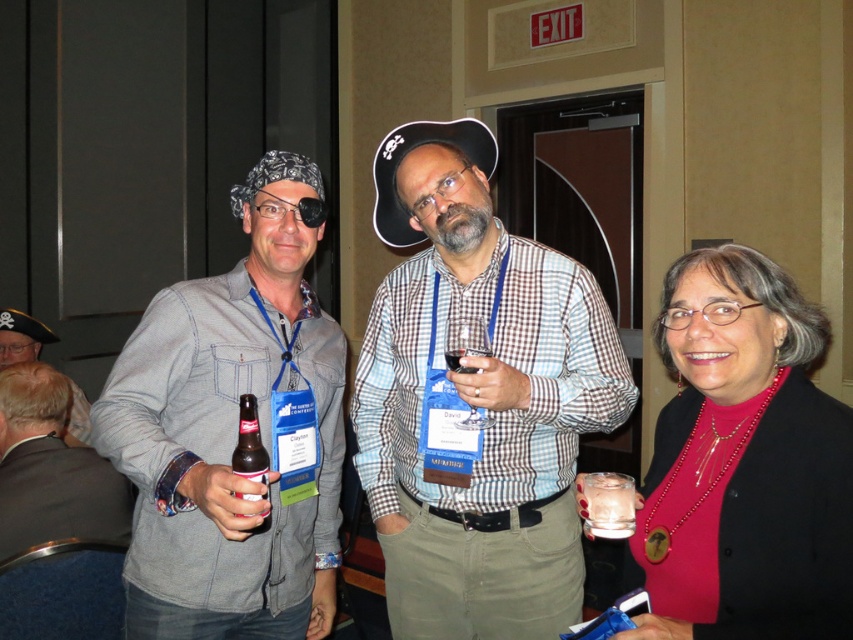
You are at a conference and need to grab your clear glass cup at lower right. Which direction should you move relative to the person in the middle who is wearing a checkered shirt and khaki pants?

The clear glass cup at lower right is located at point (x=608, y=504), so you should move to the lower right direction relative to the person in the middle wearing a checkered shirt and khaki pants.

You are organizing a photo shoot and need to place a rectangular backdrop that must be wider than the denim jacket at left. Can the brown glass bottle at center be used as a reference for the minimum width of the backdrop?

The denim jacket at left is wider than the brown glass bottle at center. Therefore, the backdrop needs to be wider than the denim jacket at left, so the brown glass bottle at center cannot be used as a reference since it is narrower than the required minimum width.

You are at the event and want to pour the contents of the brown glass bottle at center into the clear glass cup at lower right. Can you fit all the liquid from the bottle into the cup without spilling?

The clear glass cup at lower right might be wider than brown glass bottle at center, so it could potentially hold the liquid from the bottle without spilling, but the exact capacity isn